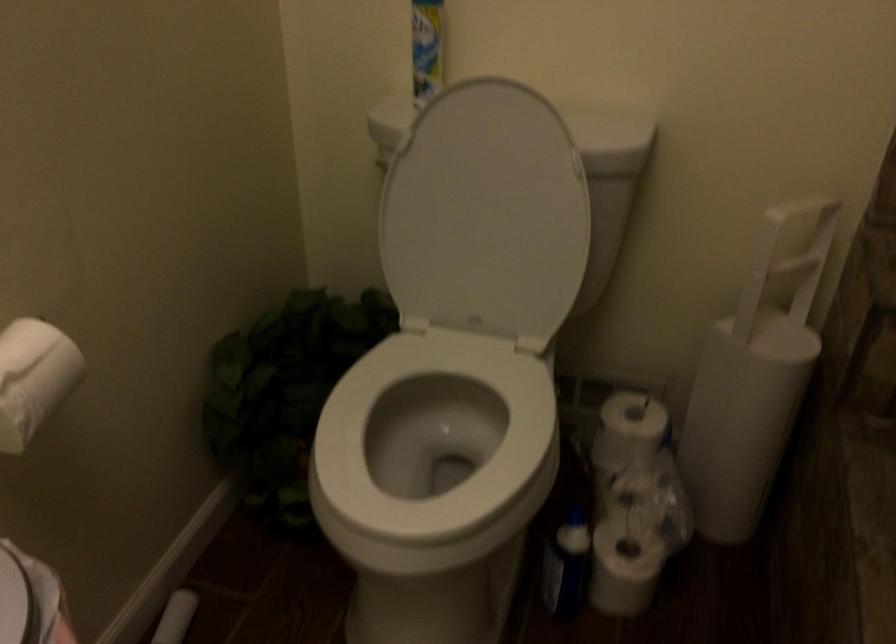
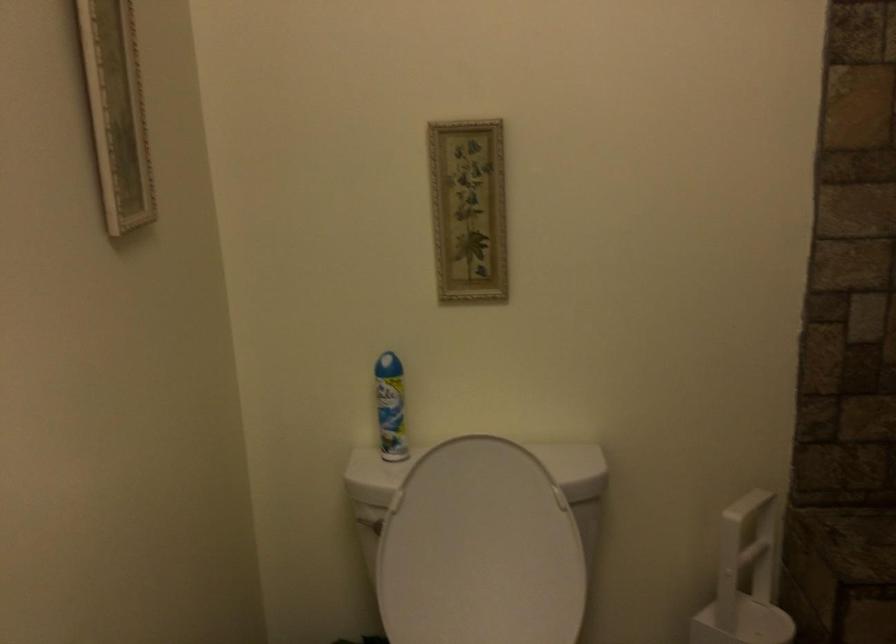
Question: The first image is from the beginning of the video and the second image is from the end. How did the camera likely rotate when shooting the video?

Choices:
 (A) Left
 (B) Right
 (C) Up
 (D) Down

Answer: (C)